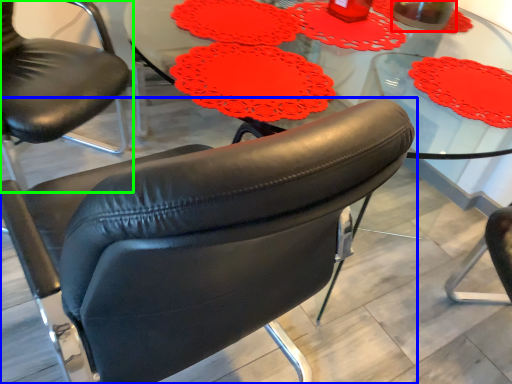
Question: Considering the real-world distances, which object is farthest from beverage (highlighted by a red box)? chair (highlighted by a blue box) or chair (highlighted by a green box)?

Choices:
 (A) chair
 (B) chair

Answer: (A)